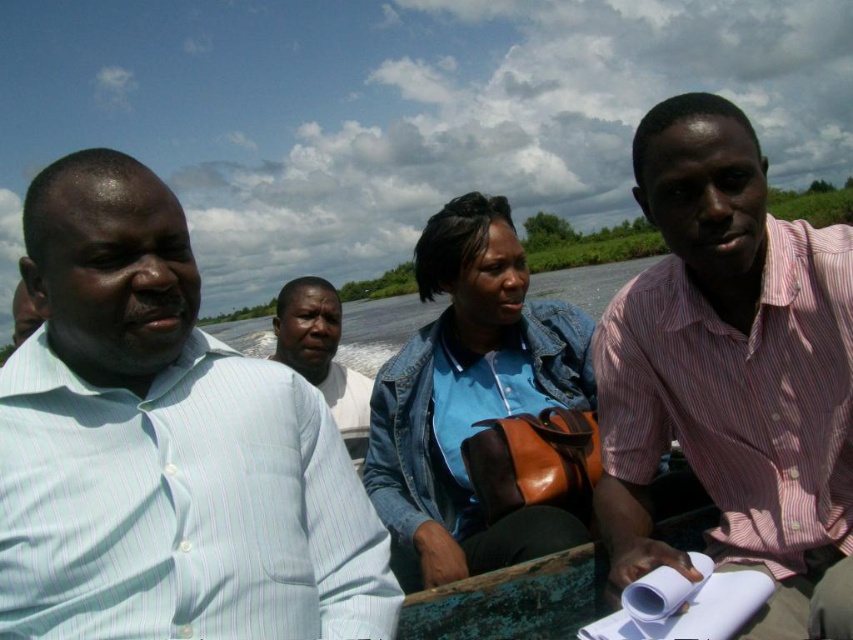
From the picture: Is light blue striped shirt at left to the left of pink striped shirt at right from the viewer's perspective?

Correct, you'll find light blue striped shirt at left to the left of pink striped shirt at right.

Can you confirm if light blue striped shirt at left is positioned below pink striped shirt at right?

Yes, light blue striped shirt at left is below pink striped shirt at right.

Is point (64, 225) more distant than point (824, 237)?

No, it is not.

Find the location of `light blue striped shirt at left`. light blue striped shirt at left is located at coordinates point(164,448).

Measure the distance between blue denim jacket at center and camera.

A distance of 2.44 meters exists between blue denim jacket at center and camera.

What do you see at coordinates (469, 397) in the screenshot? This screenshot has width=853, height=640. I see `blue denim jacket at center` at bounding box center [469, 397].

You are a GUI agent. You are given a task and a screenshot of the screen. Output one action in this format:
    pyautogui.click(x=<x>, y=<y>)
    Task: Click on the blue denim jacket at center
    
    Given the screenshot: What is the action you would take?
    pyautogui.click(x=469, y=397)

Is pink striped shirt at right smaller than light blue striped shirt at center?

Indeed, pink striped shirt at right has a smaller size compared to light blue striped shirt at center.

Which is above, pink striped shirt at right or light blue striped shirt at center?

Positioned higher is pink striped shirt at right.

Is point (840, 616) positioned before point (288, 298)?

Yes, point (840, 616) is closer to viewer.

Identify the location of pink striped shirt at right. (732, 372).